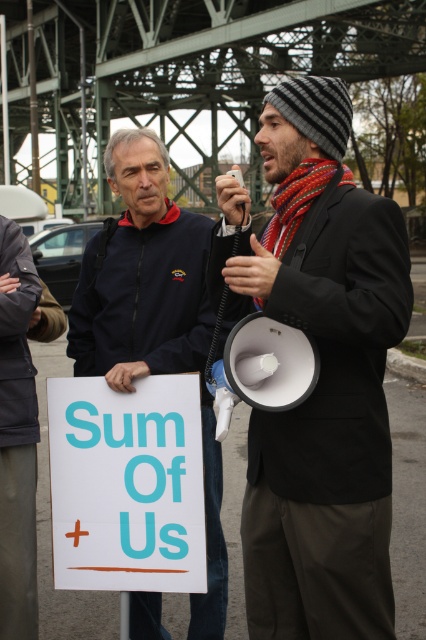
Does point (359, 445) come farther from viewer compared to point (109, 244)?

That is False.

Which is more to the right, matte black megaphone at center or dark blue jacket at center?

Positioned to the right is matte black megaphone at center.

Does point (270, 460) come in front of point (120, 266)?

Yes, point (270, 460) is in front of point (120, 266).

Locate an element on the screen. This screenshot has width=426, height=640. matte black megaphone at center is located at coordinates (319, 376).

Between dark blue jacket at center and white paper sign at center, which one appears on the left side from the viewer's perspective?

white paper sign at center is more to the left.

Which is in front, point (132, 227) or point (81, 452)?

Point (81, 452)

Who is more forward, (140, 147) or (187, 458)?

Point (187, 458)

This screenshot has width=426, height=640. In order to click on dark blue jacket at center in this screenshot , I will do `click(141, 275)`.

Looking at this image, between matte black megaphone at center and white paper sign at center, which one appears on the right side from the viewer's perspective?

Positioned to the right is matte black megaphone at center.

Which is in front, point (337, 580) or point (57, 476)?

Point (337, 580) is more forward.

Describe the element at coordinates (319, 376) in the screenshot. I see `matte black megaphone at center` at that location.

Identify the location of matte black megaphone at center. (319, 376).